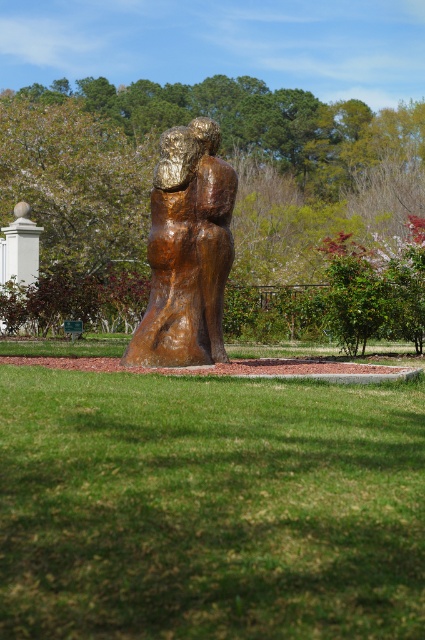
Question: Does green grass at center have a larger size compared to bronze/smoothsculpture at center?

Choices:
 (A) no
 (B) yes

Answer: (A)

Question: Which is farther from the bronze/smoothsculpture at center?

Choices:
 (A) green leafy tree at center
 (B) green grass at center

Answer: (A)

Question: Which object appears closest to the camera in this image?

Choices:
 (A) green leafy tree at center
 (B) bronze/smoothsculpture at center

Answer: (B)

Question: Does green leafy tree at center appear on the left side of bronze/smoothsculpture at center?

Choices:
 (A) yes
 (B) no

Answer: (A)

Question: Can you confirm if green leafy tree at center is positioned to the right of bronze/smoothsculpture at center?

Choices:
 (A) no
 (B) yes

Answer: (A)

Question: Which point is farther to the camera?

Choices:
 (A) [x=57, y=484]
 (B) [x=85, y=218]

Answer: (B)